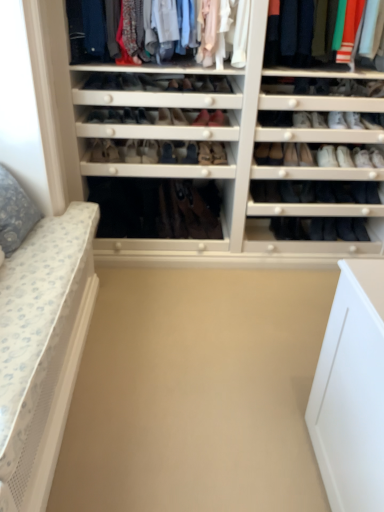
Question: From the image's perspective, is beige matte plain at center over matte black shoe at center, marked as the 12th shoe in a left-to-right arrangement?

Choices:
 (A) no
 (B) yes

Answer: (A)

Question: Can you confirm if beige matte plain at center is smaller than matte black shoe at center, arranged as the 12th shoe when viewed from the right?

Choices:
 (A) yes
 (B) no

Answer: (B)

Question: Can you confirm if beige matte plain at center is shorter than matte black shoe at center, arranged as the 12th shoe when viewed from the right?

Choices:
 (A) yes
 (B) no

Answer: (A)

Question: Is beige matte plain at center aimed at matte black shoe at center, arranged as the 12th shoe when viewed from the right?

Choices:
 (A) yes
 (B) no

Answer: (B)

Question: Is beige matte plain at center far from matte black shoe at center, marked as the 12th shoe in a left-to-right arrangement?

Choices:
 (A) yes
 (B) no

Answer: (A)

Question: Is leather at center, arranged as the 14th shoe when viewed from the right, wider or thinner than beige matte plain at center?

Choices:
 (A) thin
 (B) wide

Answer: (A)

Question: In the image, is leather at center, arranged as the 14th shoe when viewed from the right, positioned in front of or behind beige matte plain at center?

Choices:
 (A) front
 (B) behind

Answer: (B)

Question: From the image's perspective, is leather at center, the tenth shoe in the left-to-right sequence, located above or below beige matte plain at center?

Choices:
 (A) above
 (B) below

Answer: (A)

Question: Do you think leather at center, arranged as the 14th shoe when viewed from the right, is within beige matte plain at center, or outside of it?

Choices:
 (A) inside
 (B) outside

Answer: (B)

Question: From a real-world perspective, is leather brown shoe at center, arranged as the 13th shoe when viewed from the left, above or below leather shoe at center, arranged as the 1th shoe when viewed from the left?

Choices:
 (A) above
 (B) below

Answer: (A)

Question: In terms of width, does leather brown shoe at center, the eleventh shoe viewed from the right, look wider or thinner when compared to leather shoe at center, which appears as the 23th shoe when viewed from the right?

Choices:
 (A) wide
 (B) thin

Answer: (A)

Question: Is leather brown shoe at center, the eleventh shoe viewed from the right, bigger or smaller than leather shoe at center, which appears as the 23th shoe when viewed from the right?

Choices:
 (A) big
 (B) small

Answer: (A)

Question: Choose the correct answer: Is leather brown shoe at center, arranged as the 13th shoe when viewed from the left, inside leather shoe at center, arranged as the 1th shoe when viewed from the left, or outside it?

Choices:
 (A) inside
 (B) outside

Answer: (B)

Question: Considering the positions of matte black shoe at center, the 15th shoe positioned from the left, and leather shoe at center, the 10th shoe in the right-to-left sequence, in the image, is matte black shoe at center, the 15th shoe positioned from the left, wider or thinner than leather shoe at center, the 10th shoe in the right-to-left sequence,?

Choices:
 (A) thin
 (B) wide

Answer: (A)

Question: Considering the positions of point (175, 109) and point (170, 88), is point (175, 109) closer or farther from the camera than point (170, 88)?

Choices:
 (A) farther
 (B) closer

Answer: (B)